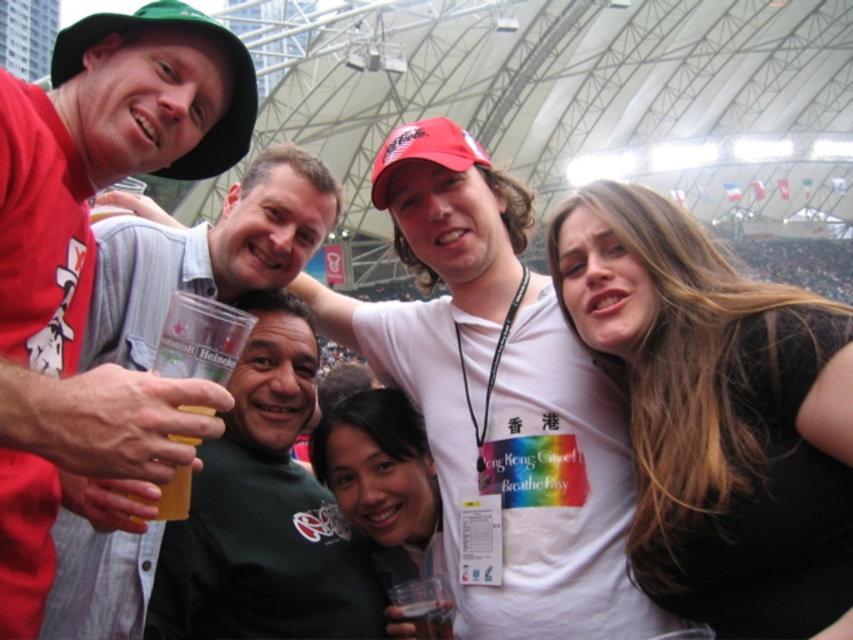
Does white cotton t-shirt at center have a larger size compared to black matte hair at upper right?

Yes.

Locate an element on the screen. white cotton t-shirt at center is located at coordinates (500, 397).

Is black matte hair at upper right taller than translucent plastic cup at center?

Yes.

Locate an element on the screen. black matte hair at upper right is located at coordinates (712, 413).

In the scene shown: Is red matte baseball cap at center positioned in front of translucent plastic cup at center?

No, red matte baseball cap at center is behind translucent plastic cup at center.

Is red matte baseball cap at center below translucent plastic cup at center?

No, red matte baseball cap at center is not below translucent plastic cup at center.

Is point (469, 145) behind point (419, 605)?

Yes.

This screenshot has width=853, height=640. I want to click on red matte baseball cap at center, so click(x=422, y=150).